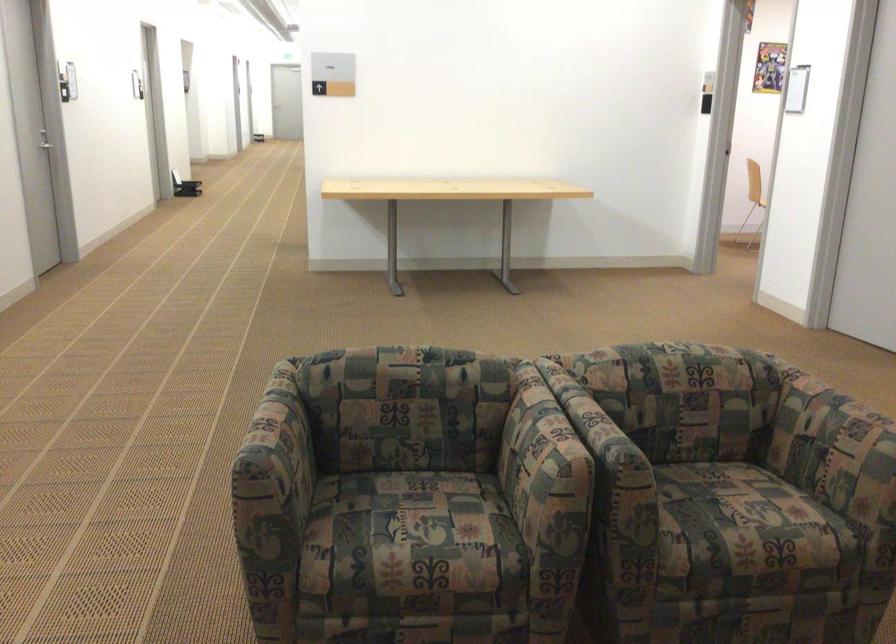
What do you see at coordinates (44, 140) in the screenshot? This screenshot has height=644, width=896. I see `a silver door handle` at bounding box center [44, 140].